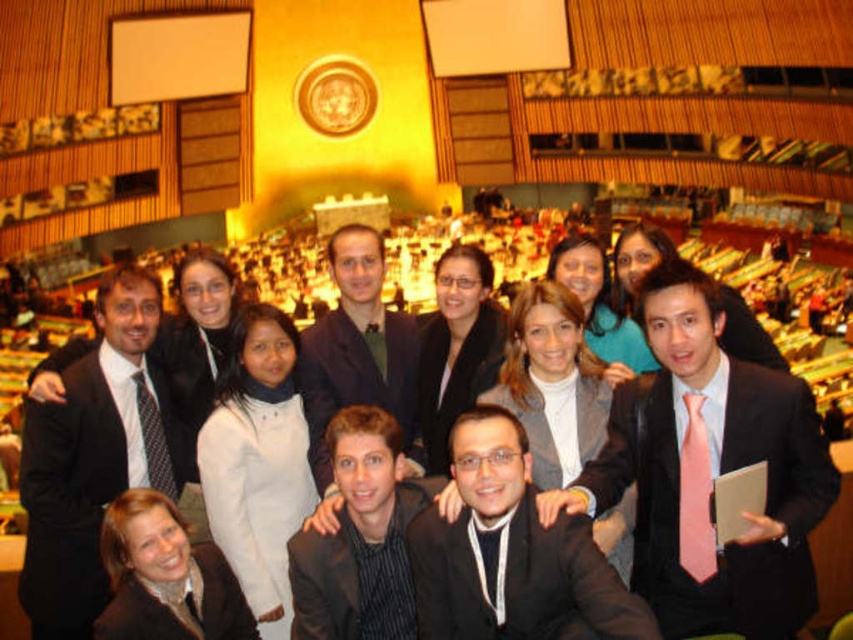
Is point (590, 602) farther from camera compared to point (450, 273)?

No, (590, 602) is in front of (450, 273).

Is black suit at center to the left of matte black jacket at center from the viewer's perspective?

Incorrect, black suit at center is not on the left side of matte black jacket at center.

The image size is (853, 640). Describe the element at coordinates (512, 554) in the screenshot. I see `black suit at center` at that location.

The image size is (853, 640). Find the location of `black suit at center`. black suit at center is located at coordinates (512, 554).

Between point (381, 346) and point (440, 339), which one is positioned behind?

The point (381, 346) is more distant.

This screenshot has width=853, height=640. What do you see at coordinates (357, 349) in the screenshot?
I see `dark blue suit at center` at bounding box center [357, 349].

The height and width of the screenshot is (640, 853). What are the coordinates of `dark blue suit at center` in the screenshot? It's located at (357, 349).

Can you confirm if pink satin tie at center is positioned to the right of black matte blazer at lower left?

Yes, pink satin tie at center is to the right of black matte blazer at lower left.

Does point (711, 528) lie in front of point (167, 634)?

No, it is behind (167, 634).

Who is more forward, (717, 316) or (233, 627)?

Point (233, 627) is more forward.

You are a GUI agent. You are given a task and a screenshot of the screen. Output one action in this format:
    pyautogui.click(x=<x>, y=<y>)
    Task: Click on the pink satin tie at center
    The height and width of the screenshot is (640, 853).
    Given the screenshot: What is the action you would take?
    pyautogui.click(x=709, y=472)